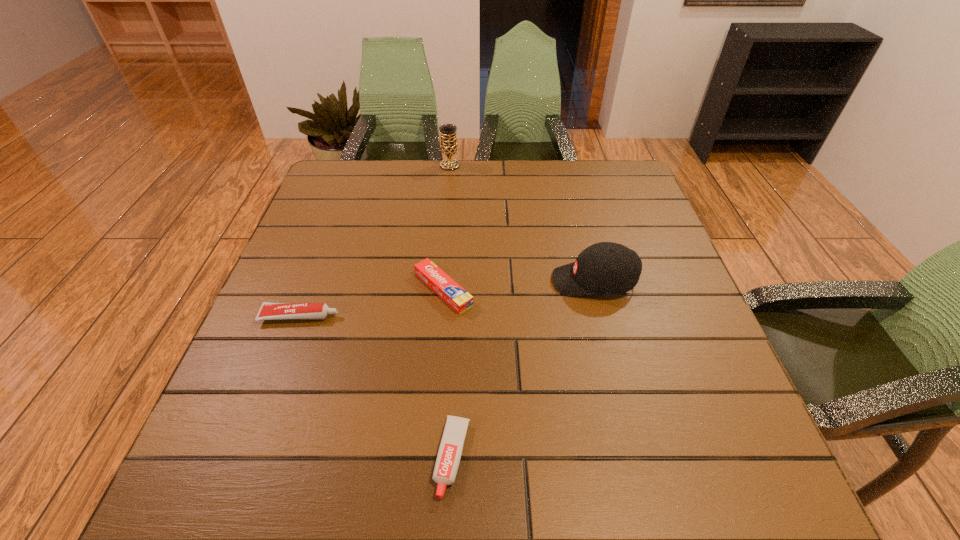
The image size is (960, 540). I want to click on free space located 0.190m at the nozzle of the leftmost toothpaste, so click(426, 316).

Locate an element on the screen. Image resolution: width=960 pixels, height=540 pixels. vacant space located 0.190m on the right of the nearest toothpaste is located at coordinates (583, 457).

This screenshot has height=540, width=960. Identify the location of object that is positioned at the far edge. (448, 146).

You are a GUI agent. You are given a task and a screenshot of the screen. Output one action in this format:
    pyautogui.click(x=<x>, y=<y>)
    Task: Click on the object that is at the near edge
    Image resolution: width=960 pixels, height=540 pixels.
    Given the screenshot: What is the action you would take?
    pyautogui.click(x=451, y=446)

Locate an element on the screen. The width and height of the screenshot is (960, 540). object positioned at the left edge is located at coordinates (268, 311).

I want to click on object situated at the right edge, so click(x=608, y=268).

In the image, there is a desktop. Identify the location of blank space at the far edge. The height and width of the screenshot is (540, 960). (401, 199).

The image size is (960, 540). In order to click on blank space at the near edge of the desktop in this screenshot , I will do `click(477, 492)`.

This screenshot has height=540, width=960. In order to click on free region at the left edge in this screenshot , I will do `click(301, 281)`.

Image resolution: width=960 pixels, height=540 pixels. Identify the location of vacant point at the right edge. (677, 406).